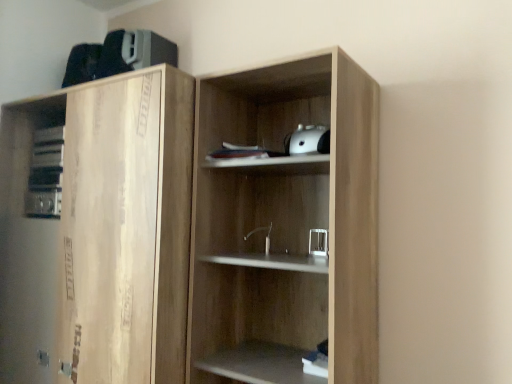
Question: Considering the relative sizes of wooden cupboard at center and natural wood cabinet at left in the image provided, is wooden cupboard at center thinner than natural wood cabinet at left?

Choices:
 (A) yes
 (B) no

Answer: (A)

Question: Can you confirm if wooden cupboard at center is smaller than natural wood cabinet at left?

Choices:
 (A) no
 (B) yes

Answer: (B)

Question: Considering the relative sizes of wooden cupboard at center and natural wood cabinet at left in the image provided, is wooden cupboard at center bigger than natural wood cabinet at left?

Choices:
 (A) yes
 (B) no

Answer: (B)

Question: Is wooden cupboard at center beside natural wood cabinet at left?

Choices:
 (A) yes
 (B) no

Answer: (B)

Question: Is natural wood cabinet at left surrounded by wooden cupboard at center?

Choices:
 (A) no
 (B) yes

Answer: (A)

Question: Is wooden cupboard at center facing away from natural wood cabinet at left?

Choices:
 (A) no
 (B) yes

Answer: (A)

Question: Does natural wood cabinet at left have a larger size compared to wooden cupboard at center?

Choices:
 (A) yes
 (B) no

Answer: (A)

Question: Is natural wood cabinet at left next to wooden cupboard at center and touching it?

Choices:
 (A) yes
 (B) no

Answer: (B)

Question: Is natural wood cabinet at left to the right of wooden cupboard at center from the viewer's perspective?

Choices:
 (A) yes
 (B) no

Answer: (B)

Question: Is wooden cupboard at center at the back of natural wood cabinet at left?

Choices:
 (A) yes
 (B) no

Answer: (B)

Question: From a real-world perspective, is natural wood cabinet at left positioned over wooden cupboard at center based on gravity?

Choices:
 (A) no
 (B) yes

Answer: (A)

Question: Considering the relative sizes of natural wood cabinet at left and wooden cupboard at center in the image provided, is natural wood cabinet at left thinner than wooden cupboard at center?

Choices:
 (A) no
 (B) yes

Answer: (A)

Question: Looking at their shapes, would you say natural wood cabinet at left is wider or thinner than wooden cupboard at center?

Choices:
 (A) wide
 (B) thin

Answer: (A)